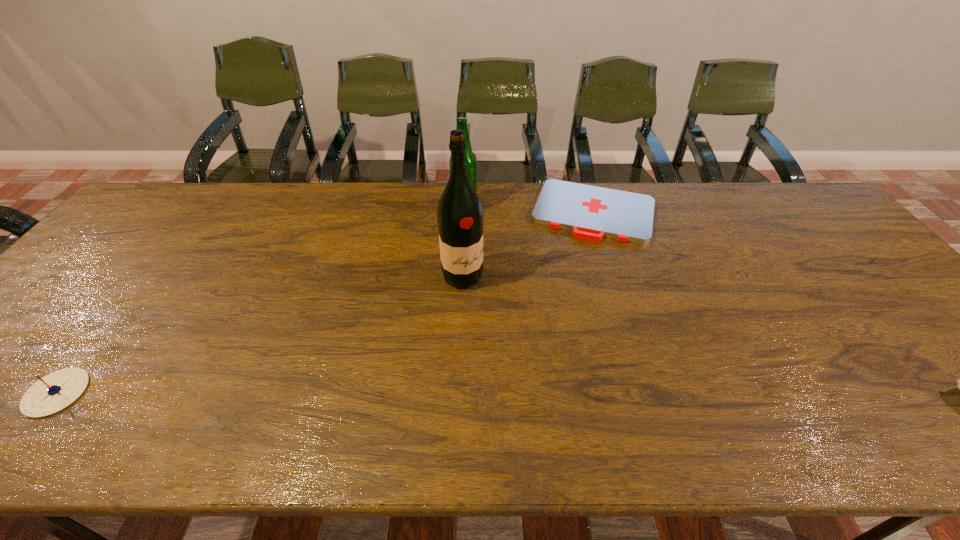
You are a GUI agent. You are given a task and a screenshot of the screen. Output one action in this format:
    pyautogui.click(x=<x>, y=<y>)
    Task: Click on the free space located 0.180m on the front-facing side of the liquor
    The height and width of the screenshot is (540, 960).
    Given the screenshot: What is the action you would take?
    pyautogui.click(x=516, y=331)

The height and width of the screenshot is (540, 960). Find the location of `vacant space located on the label of the beer bottle`. vacant space located on the label of the beer bottle is located at coordinates (495, 237).

Locate an element on the screen. The height and width of the screenshot is (540, 960). free spot located 0.210m on the label of the beer bottle is located at coordinates (509, 250).

Where is `vacant area situated on the label of the beer bottle`? vacant area situated on the label of the beer bottle is located at coordinates (513, 254).

Find the location of a particular element. The height and width of the screenshot is (540, 960). free space located on handle side the shortest object is located at coordinates (567, 297).

This screenshot has width=960, height=540. I want to click on free space located on handle side the shortest object, so (575, 267).

At what (x,y) coordinates should I click in order to perform the action: click on free space located 0.160m on handle side the shortest object. Please return your answer as a coordinate pair (x, y). This screenshot has height=540, width=960. Looking at the image, I should click on (572, 279).

Find the location of a particular element. The image size is (960, 540). beer bottle that is positioned at the far edge is located at coordinates (470, 158).

You are a GUI agent. You are given a task and a screenshot of the screen. Output one action in this format:
    pyautogui.click(x=<x>, y=<y>)
    Task: Click on the first-aid kit that is positioned at the far edge
    The height and width of the screenshot is (540, 960).
    Given the screenshot: What is the action you would take?
    pyautogui.click(x=592, y=213)

Locate an element on the screen. The width and height of the screenshot is (960, 540). object that is at the near edge is located at coordinates (54, 392).